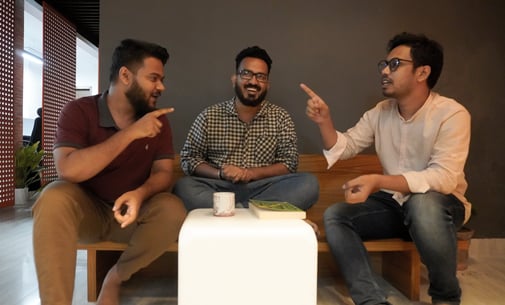
I want to click on book, so click(x=280, y=203).